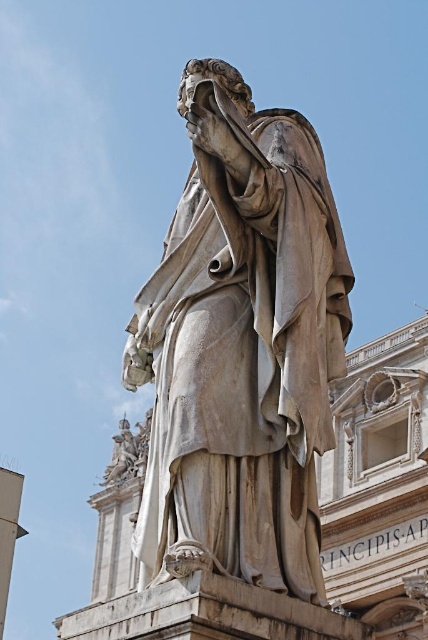
Question: Where is white marble statue at center located in relation to white marble statue at lower left in the image?

Choices:
 (A) left
 (B) right

Answer: (B)

Question: Can you confirm if white marble statue at center is thinner than white marble statue at lower left?

Choices:
 (A) yes
 (B) no

Answer: (A)

Question: Is white marble statue at center to the left of white marble statue at lower left from the viewer's perspective?

Choices:
 (A) yes
 (B) no

Answer: (B)

Question: Which object appears farthest from the camera in this image?

Choices:
 (A) white marble statue at lower left
 (B) white marble statue at center

Answer: (A)